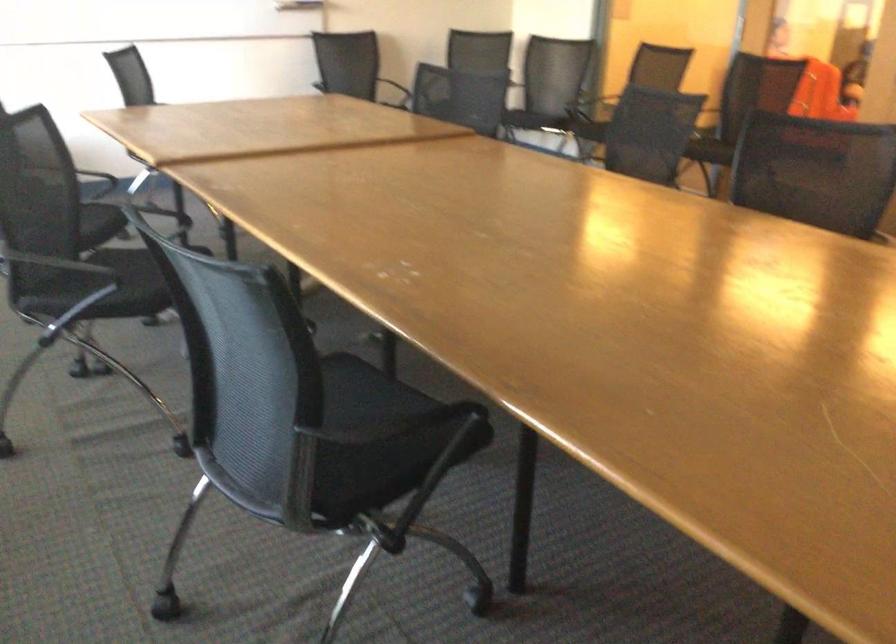
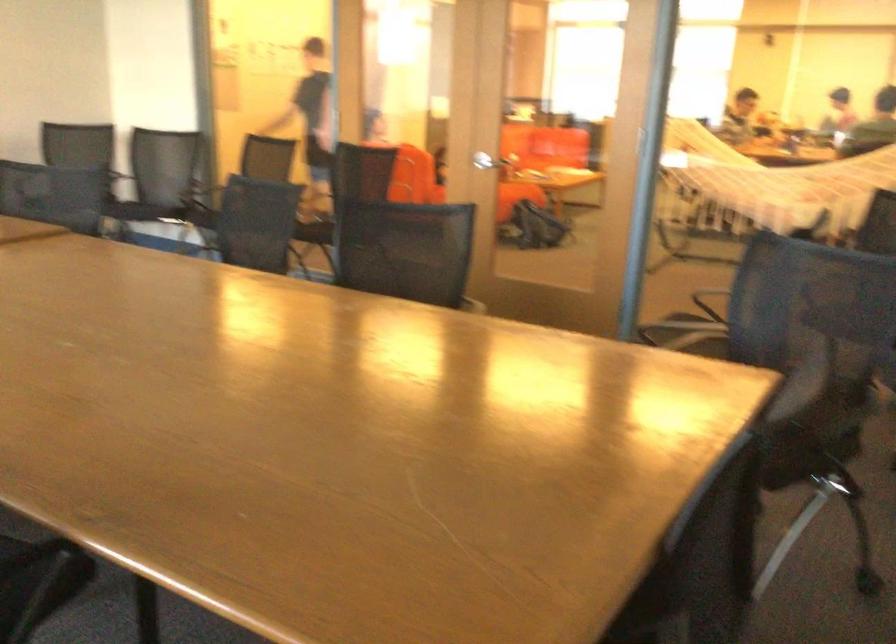
The images are taken continuously from a first-person perspective. In which direction are you moving?

The cameraman walked toward right, forward.